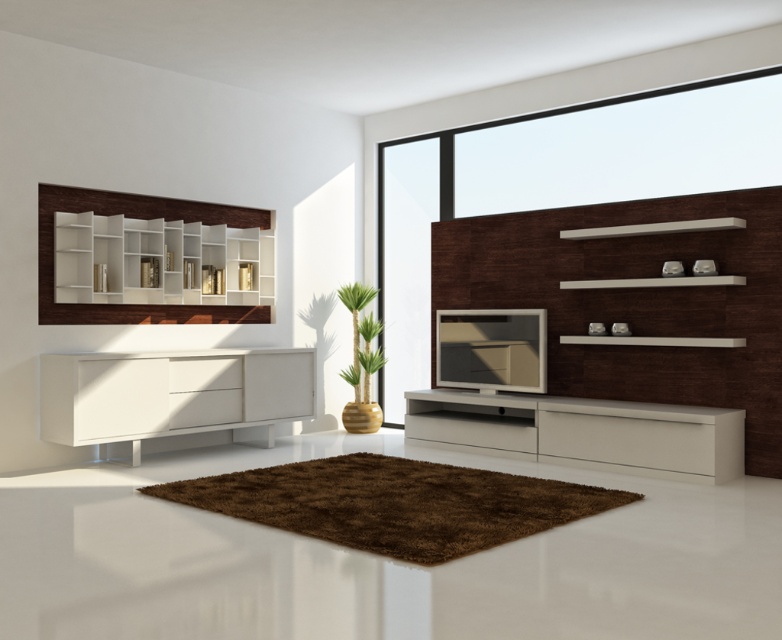
You are an interior designer planning to place a new 24 inch tall decorative item in the living room. You have two options for placement locations. The first option is on top of the white matte sideboard at left, and the second option is on top of the white glossy tv stand at center. Which location would you choose to ensure the decorative item doesn

The white matte sideboard at left has a greater height compared to the white glossy tv stand at center. Therefore, placing the 24 inch tall decorative item on the white matte sideboard at left would be more stable and visually balanced since it can support taller items better.

You are standing in the living room and want to place a new plant on the closest white object to you. Which object should you choose between the white glossy tv stand at center and the white wood shelves at upper left?

The white glossy tv stand at center is closer to the viewer than the white wood shelves at upper left, so you should place the plant on the white glossy tv stand at center.